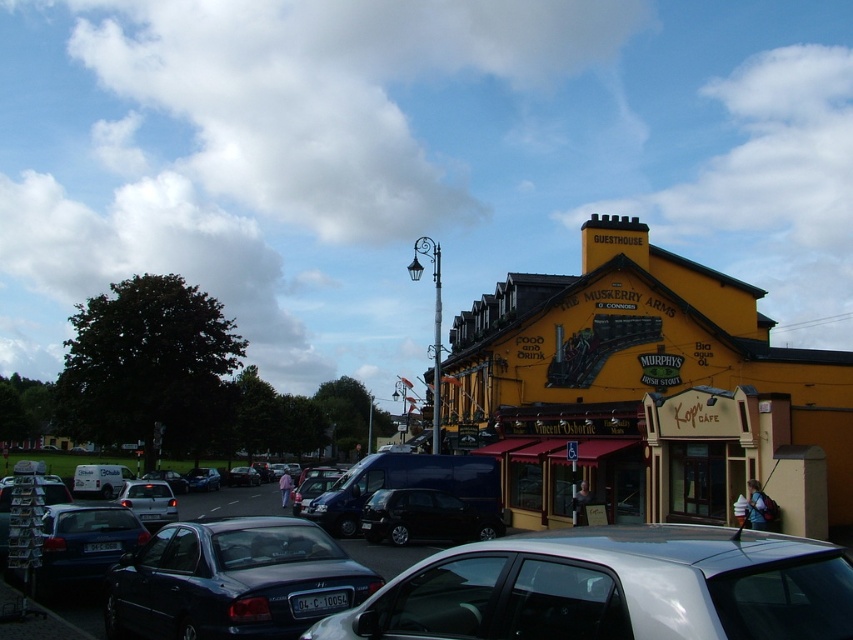
Question: Does shiny black van at center come behind metallic gray car at lower center?

Choices:
 (A) no
 (B) yes

Answer: (B)

Question: Which of these objects is positioned farthest from the silver metallic hatchback at center?

Choices:
 (A) silver metallic car at lower center
 (B) shiny black sedan at center
 (C) metallic silver car at center
 (D) shiny black van at center

Answer: (C)

Question: Does yellow painted building at center have a smaller size compared to metallic blue sedan at lower left?

Choices:
 (A) yes
 (B) no

Answer: (B)

Question: Estimate the real-world distances between objects in this image. Which object is closer to the shiny black van at center?

Choices:
 (A) metallic blue sedan at lower left
 (B) silver metallic car at lower center
 (C) yellow painted building at center

Answer: (C)

Question: Does shiny dark blue sedan at center have a lesser width compared to metallic silver car at center?

Choices:
 (A) no
 (B) yes

Answer: (B)

Question: Among these points, which one is farthest from the camera?

Choices:
 (A) (195, 490)
 (B) (160, 484)
 (C) (229, 472)

Answer: (C)